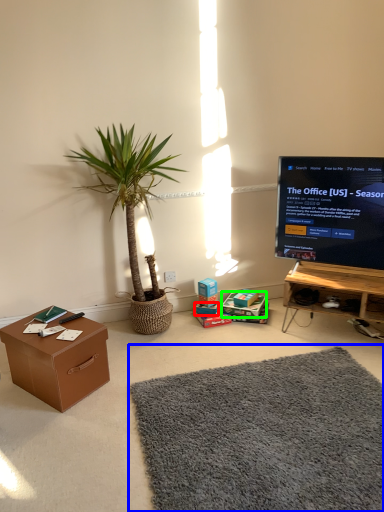
Question: Based on their relative distances, which object is nearer to box (highlighted by a red box)? Choose from mat (highlighted by a blue box) and cardboard box (highlighted by a green box).

Choices:
 (A) mat
 (B) cardboard box

Answer: (B)